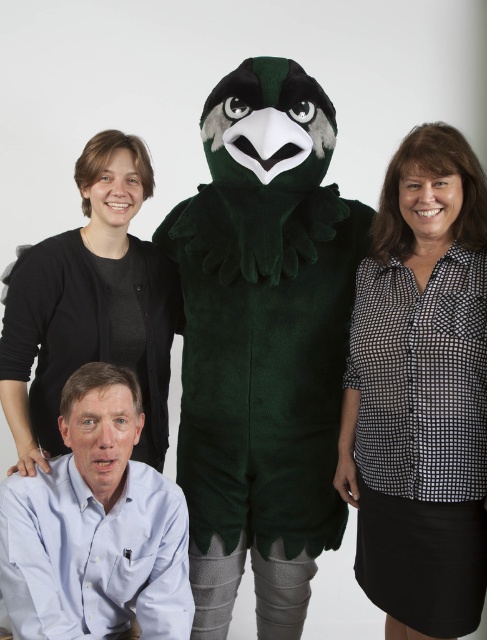
You are a photographer trying to adjust the lighting for a group photo. You notice two shirts in the scene, the black checkered shirt at right and the light blue shirt at lower left. Which shirt is positioned higher in the image?

The black checkered shirt at right is positioned higher in the image than the light blue shirt at lower left.

You are a photographer trying to adjust the lighting for a group photo. You notice two people in the image wearing a light blue shirt at lower left and a black soft sweater at upper left. Which clothing item is closer to the bottom of the image?

The light blue shirt at lower left is positioned under the black soft sweater at upper left, meaning it is closer to the bottom of the image.

You are a photographer trying to adjust the lighting for a group photo. You notice the black checkered shirt at right and the black soft sweater at upper left. How far apart are these two items in inches?

The black checkered shirt at right is 22.31 inches from the black soft sweater at upper left.